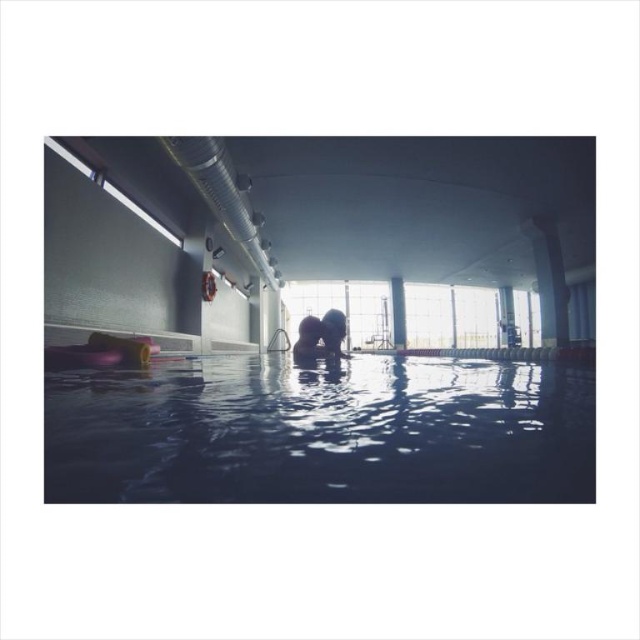
Question: Can you confirm if transparent blue water at center is positioned to the right of smooth skin person at center?

Choices:
 (A) yes
 (B) no

Answer: (A)

Question: Which is nearer to the smooth skin person at center?

Choices:
 (A) transparent plastic swim float at center
 (B) transparent blue water at center

Answer: (B)

Question: Which of the following is the farthest from the observer?

Choices:
 (A) smooth skin person at center
 (B) transparent plastic swim float at center

Answer: (A)

Question: Does transparent blue water at center have a greater width compared to smooth skin person at center?

Choices:
 (A) yes
 (B) no

Answer: (A)

Question: Which of the following is the closest to the observer?

Choices:
 (A) (540, 410)
 (B) (298, 355)

Answer: (A)

Question: Does transparent blue water at center lie behind smooth skin person at center?

Choices:
 (A) yes
 (B) no

Answer: (B)